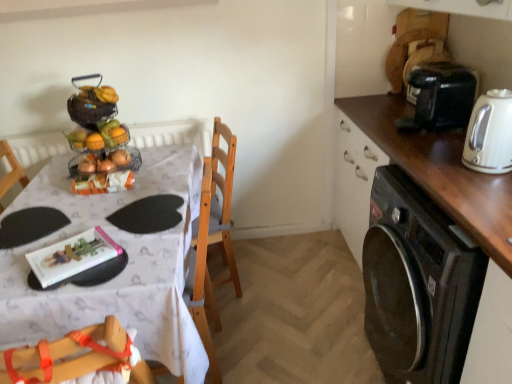
At what (x,y) coordinates should I click in order to perform the action: click on vacant space situated above white glossy table at upper left (from a real-world perspective). Please return your answer as a coordinate pair (x, y). This screenshot has width=512, height=384. Looking at the image, I should click on (105, 213).